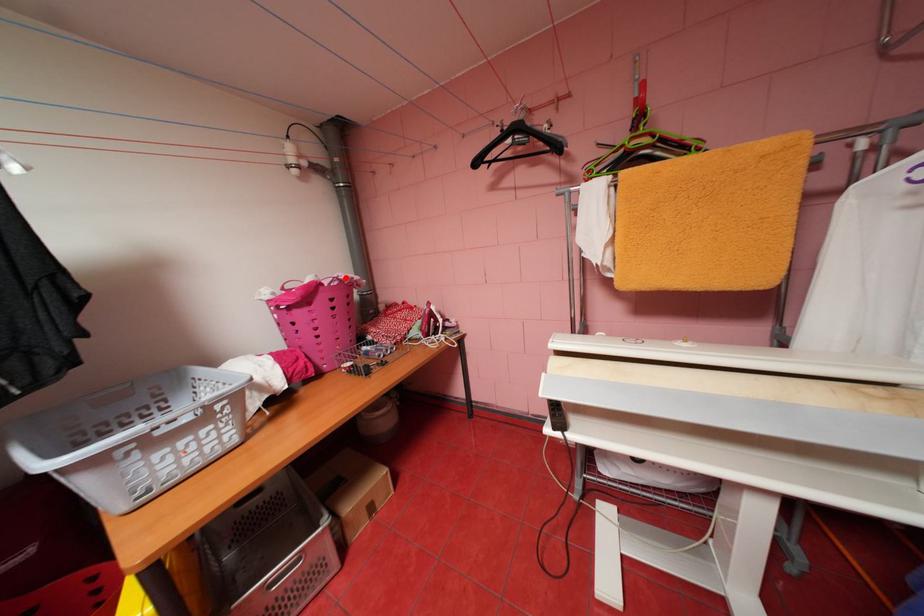
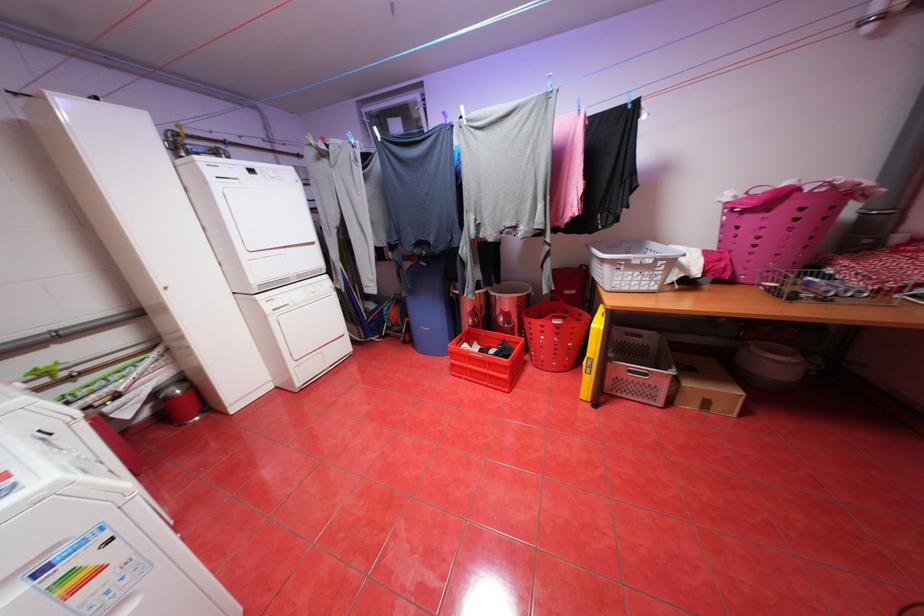
Find the pixel in the second image that matches the highlighted location in the first image.

(839, 183)